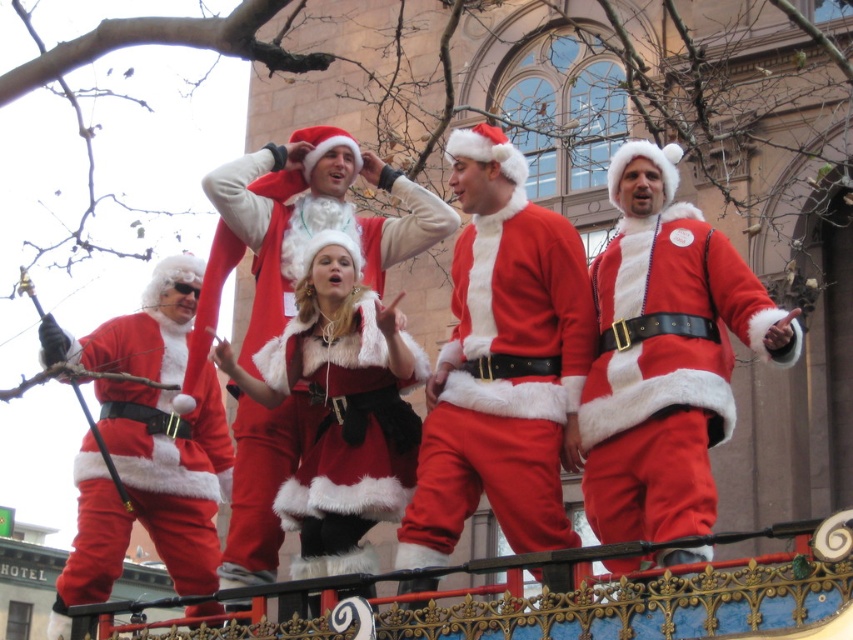
You are directing a parade float and need to position two Santas so that the fuzzy red santa suit at center can be seen by the crowd on the right side, while the matte red santa suit at left is visible to the left audience. Based on their current positions, is this arrangement possible?

Yes, the arrangement is possible because the fuzzy red santa suit at center is already positioned to the right of the matte red santa suit at left, aligning with the desired visibility for both sides of the crowd.